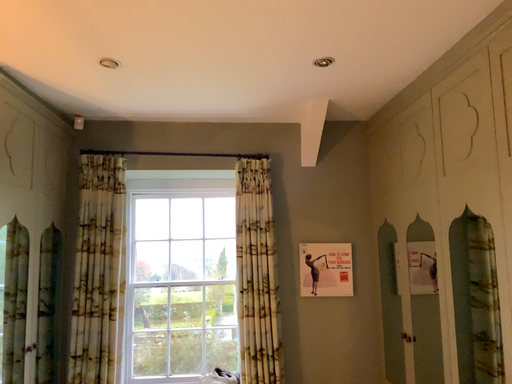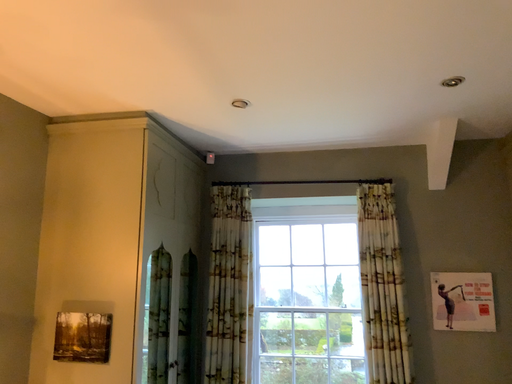
Question: How did the camera likely rotate when shooting the video?

Choices:
 (A) rotated right
 (B) rotated left

Answer: (B)